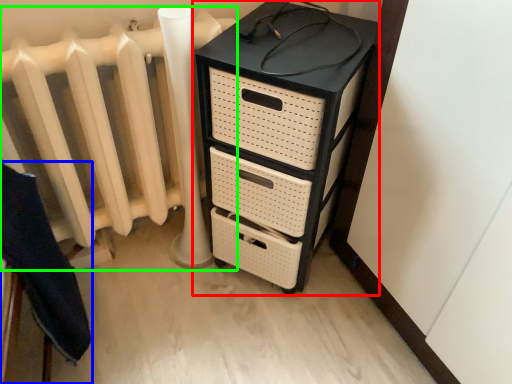
Question: Based on their relative distances, which object is farther from chest of drawers (highlighted by a red box)? Choose from furniture (highlighted by a blue box) and radiator (highlighted by a green box).

Choices:
 (A) furniture
 (B) radiator

Answer: (A)